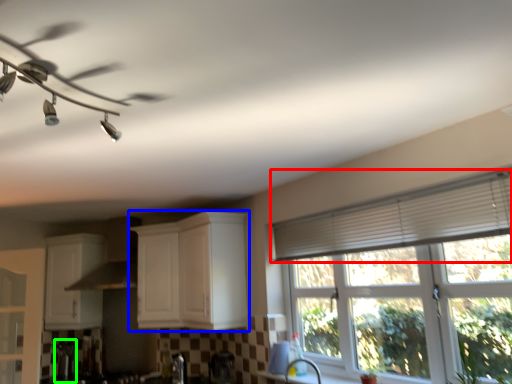
Question: Which is nearer to the shutter (highlighted by a red box)? cabinetry (highlighted by a blue box) or appliance (highlighted by a green box).

Choices:
 (A) cabinetry
 (B) appliance

Answer: (A)